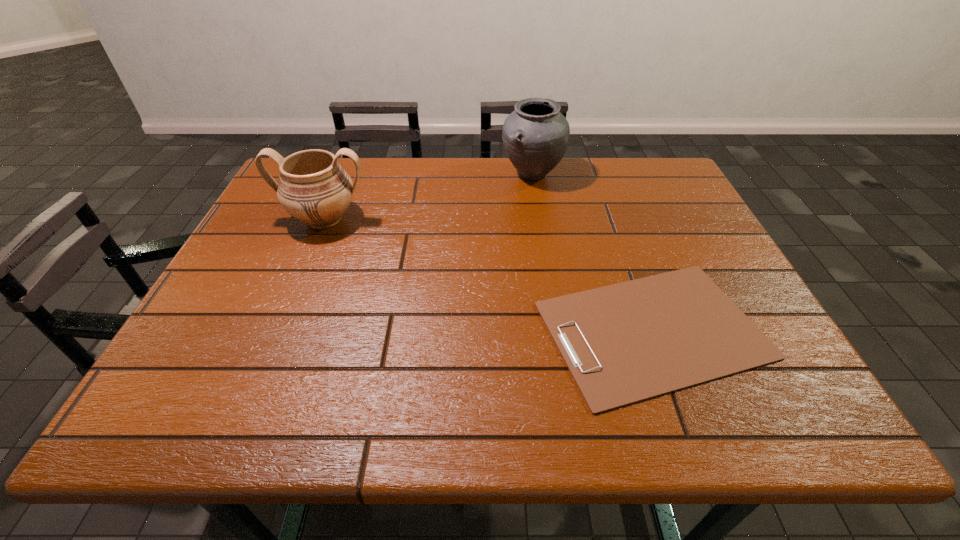
The image size is (960, 540). Identify the location of unoccupied area between the nearer urn and the clipboard. point(489,274).

Find the location of a particular element. blank region between the leftmost object and the shortest object is located at coordinates (489, 274).

Where is `free space that is in between the farther urn and the nearest object`? The image size is (960, 540). free space that is in between the farther urn and the nearest object is located at coordinates (592, 252).

The image size is (960, 540). Find the location of `free space between the right urn and the clipboard`. free space between the right urn and the clipboard is located at coordinates (592, 252).

In order to click on unoccupied position between the farther urn and the nearer urn in this screenshot , I will do `click(428, 197)`.

Locate an element on the screen. The width and height of the screenshot is (960, 540). free space between the right urn and the nearest object is located at coordinates (592, 252).

You are a GUI agent. You are given a task and a screenshot of the screen. Output one action in this format:
    pyautogui.click(x=<x>, y=<y>)
    Task: Click on the blank region between the clipboard and the second farthest object
    The width and height of the screenshot is (960, 540).
    Given the screenshot: What is the action you would take?
    pyautogui.click(x=489, y=274)

The height and width of the screenshot is (540, 960). What are the coordinates of `free space between the shortest object and the left urn` in the screenshot? It's located at (489, 274).

Identify the location of empty location between the nearest object and the nearer urn. (489, 274).

Identify which object is the nearest to the leftmost object. Please provide its 2D coordinates. Your answer should be formatted as a tuple, i.e. [(x, y)], where the tuple contains the x and y coordinates of a point satisfying the conditions above.

[(535, 135)]